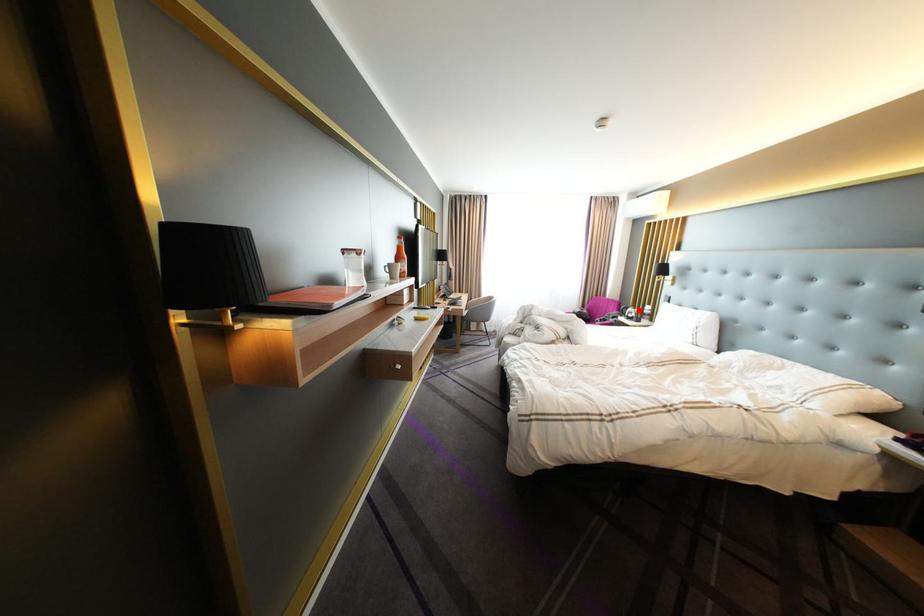
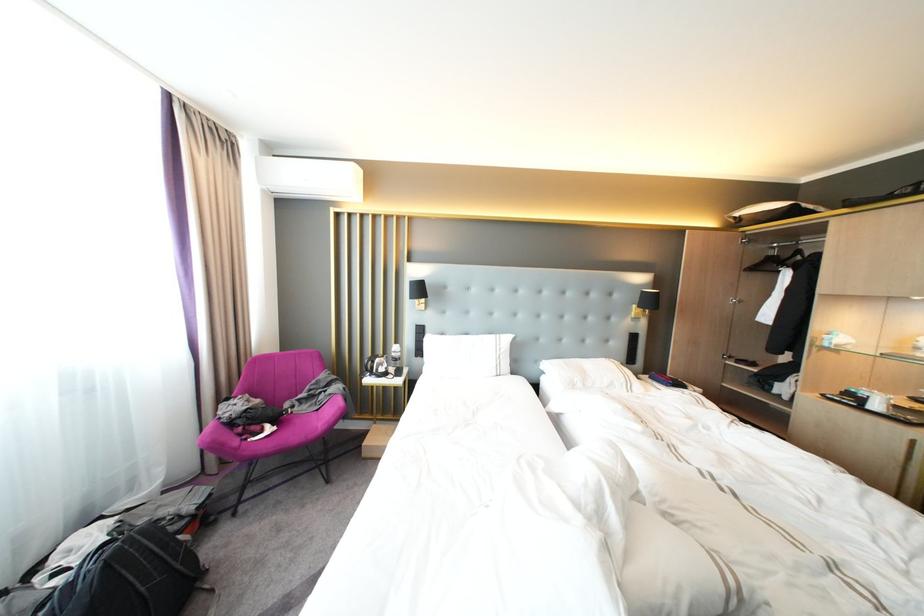
Locate, in the second image, the point that corresponds to the highlighted location in the first image.

(384, 363)